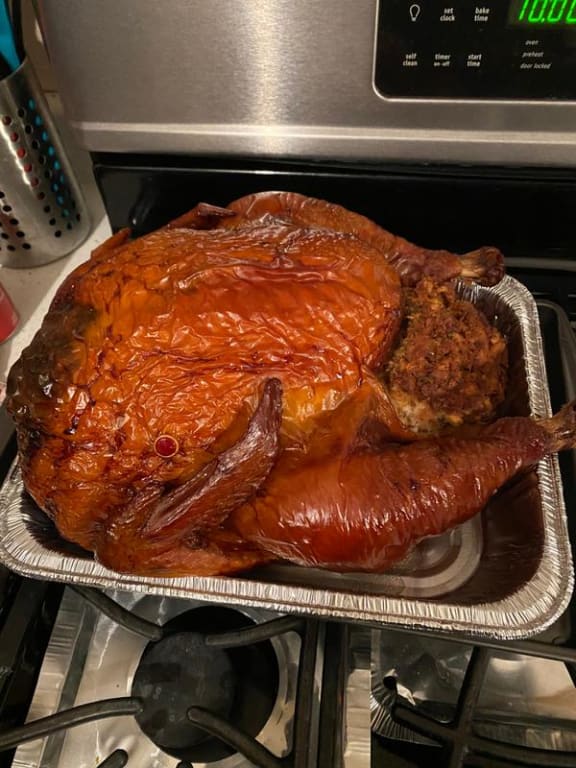
The height and width of the screenshot is (768, 576). Find the location of `stuffing`. stuffing is located at coordinates (439, 365).